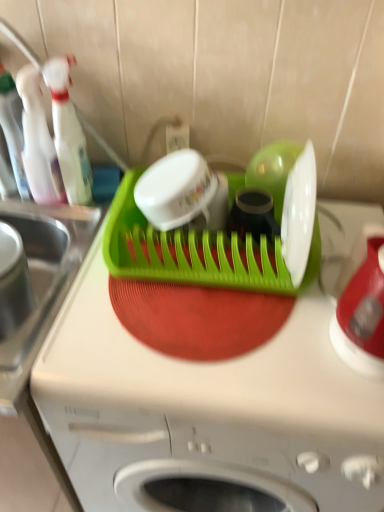
Question: Is red glossy kettle at right, placed as the 1th appliance when sorted from right to left, thinner than green plastic dish rack at center?

Choices:
 (A) no
 (B) yes

Answer: (B)

Question: From the image's perspective, does red glossy kettle at right, placed as the 1th appliance when sorted from right to left, appear lower than green plastic dish rack at center?

Choices:
 (A) no
 (B) yes

Answer: (A)

Question: Considering the relative positions of red glossy kettle at right, placed as the 1th appliance when sorted from right to left, and green plastic dish rack at center in the image provided, is red glossy kettle at right, placed as the 1th appliance when sorted from right to left, to the right of green plastic dish rack at center from the viewer's perspective?

Choices:
 (A) no
 (B) yes

Answer: (B)

Question: Is red glossy kettle at right, the 2th appliance positioned from the left, far from green plastic dish rack at center?

Choices:
 (A) yes
 (B) no

Answer: (B)

Question: From a real-world perspective, is red glossy kettle at right, the 2th appliance positioned from the left, positioned over green plastic dish rack at center based on gravity?

Choices:
 (A) no
 (B) yes

Answer: (B)

Question: Is red glossy kettle at right, the 2th appliance positioned from the left, at the left side of green plastic dish rack at center?

Choices:
 (A) yes
 (B) no

Answer: (B)

Question: From the image's perspective, is transparent plastic spray bottle at upper left, which ranks as the 3th bottle in left-to-right order, below green plastic dish rack at center, the 1th appliance positioned from the left?

Choices:
 (A) no
 (B) yes

Answer: (A)

Question: Is transparent plastic spray bottle at upper left, the first bottle viewed from the right, to the right of green plastic dish rack at center, the 1th appliance positioned from the left, from the viewer's perspective?

Choices:
 (A) yes
 (B) no

Answer: (B)

Question: Does transparent plastic spray bottle at upper left, the first bottle viewed from the right, lie behind green plastic dish rack at center, the 1th appliance positioned from the left?

Choices:
 (A) no
 (B) yes

Answer: (B)

Question: Is transparent plastic spray bottle at upper left, the first bottle viewed from the right, turned away from green plastic dish rack at center, the 1th appliance positioned from the left?

Choices:
 (A) yes
 (B) no

Answer: (B)

Question: Is transparent plastic spray bottle at upper left, which ranks as the 3th bottle in left-to-right order, positioned beyond the bounds of green plastic dish rack at center, the 1th appliance positioned from the left?

Choices:
 (A) no
 (B) yes

Answer: (B)

Question: Could you tell me if transparent plastic spray bottle at upper left, which ranks as the 3th bottle in left-to-right order, is facing green plastic dish rack at center, the 1th appliance positioned from the left?

Choices:
 (A) no
 (B) yes

Answer: (A)

Question: Can you confirm if transparent plastic spray bottle at upper left, the first bottle viewed from the right, is positioned to the right of green plastic dish rack at center?

Choices:
 (A) yes
 (B) no

Answer: (B)